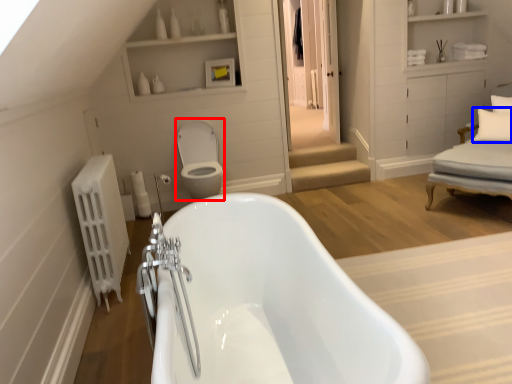
Question: Among these objects, which one is farthest to the camera, toilet bowl (highlighted by a red box) or pillow (highlighted by a blue box)?

Choices:
 (A) toilet bowl
 (B) pillow

Answer: (B)